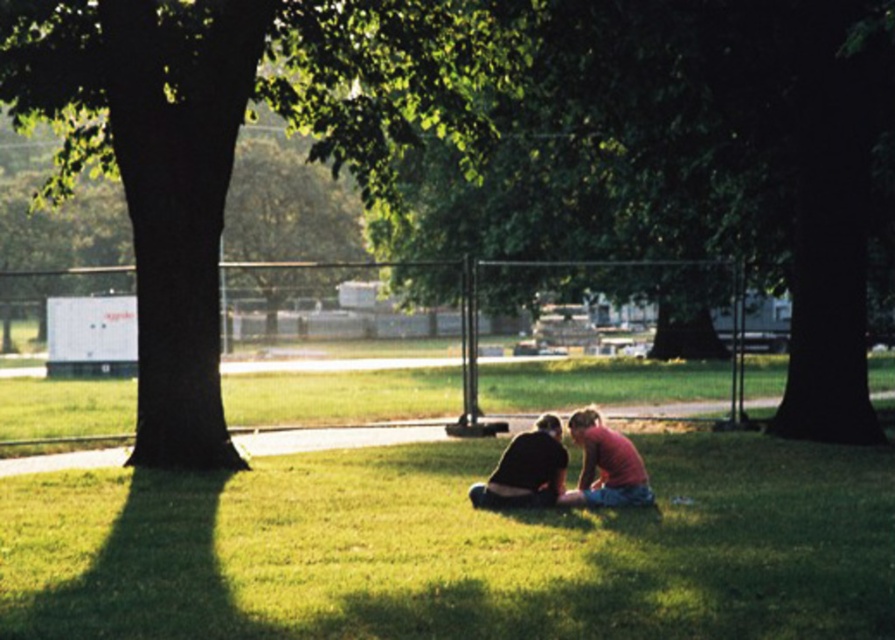
You are a gardener who needs to water both the green grassy at center and the green leafy tree at center. If your watering can holds enough water for 5 meters of travel, can you water both without refilling?

The distance between the green grassy at center and the green leafy tree at center is 5.54 meters. Since your watering can can only cover 5 meters of travel, you will need to refill before watering both areas.

You are a photographer trying to capture the matte pink shirt at center and the green grassy at center in a single shot. Which object will occupy more space in the photo?

The green grassy at center will occupy more space in the photo because it is bigger than the matte pink shirt at center.

From the picture: You are standing at the origin point of the coordinate system. You see a point marked at coordinate (565, 468). What is located at that point?

The point at coordinate (565, 468) indicates the pink fabric couple at center.